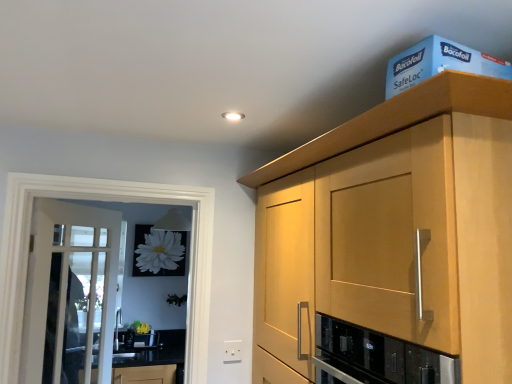
Where is `free space above clear glass screen door at left (from a real-world perspective)`? Image resolution: width=512 pixels, height=384 pixels. free space above clear glass screen door at left (from a real-world perspective) is located at coordinates (115, 172).